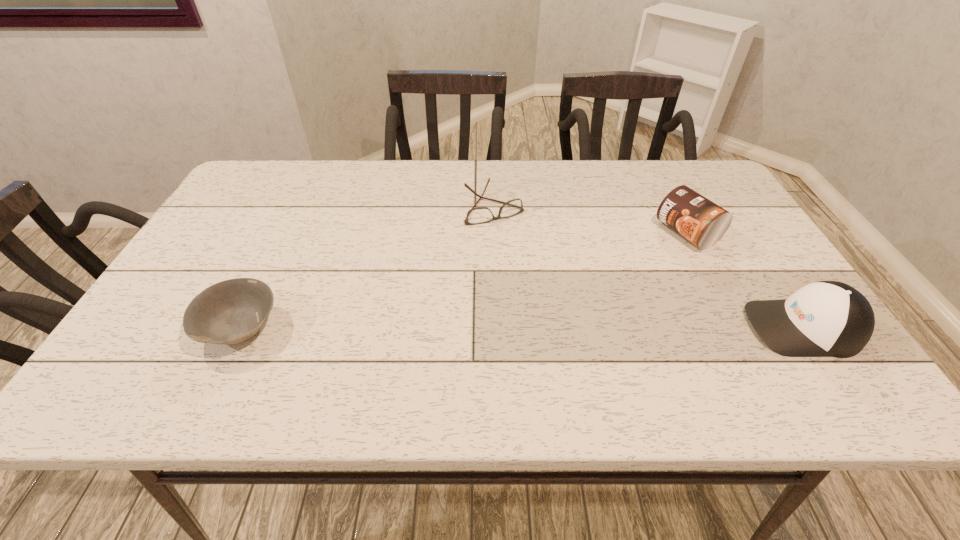
In order to click on bowl in this screenshot , I will do `click(229, 312)`.

The height and width of the screenshot is (540, 960). Identify the location of the second shortest object. (229, 312).

Where is `cap`? Image resolution: width=960 pixels, height=540 pixels. cap is located at coordinates (826, 318).

Where is `the shortest object`? This screenshot has height=540, width=960. the shortest object is located at coordinates (480, 215).

This screenshot has height=540, width=960. Identify the location of spectacles. (480, 215).

The height and width of the screenshot is (540, 960). Find the location of `can`. can is located at coordinates (702, 222).

The width and height of the screenshot is (960, 540). In order to click on vacant region located on the left of the bowl in this screenshot , I will do [177, 327].

In order to click on vacant space located on the front panel of the cap in this screenshot , I will do `click(614, 327)`.

Locate an element on the screen. The height and width of the screenshot is (540, 960). free space located 0.150m on the front panel of the cap is located at coordinates (679, 327).

Find the location of a particular element. Image resolution: width=960 pixels, height=540 pixels. vacant region located 0.390m on the front panel of the cap is located at coordinates 568,327.